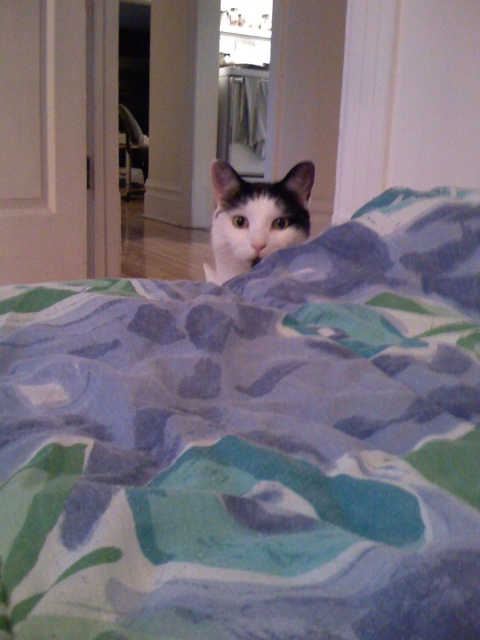
Question: Does printed fabric blanket at center have a larger size compared to white fur cat at center?

Choices:
 (A) no
 (B) yes

Answer: (B)

Question: Observing the image, what is the correct spatial positioning of printed fabric blanket at center in reference to white fur cat at center?

Choices:
 (A) above
 (B) below

Answer: (B)

Question: Which of the following is the closest to the observer?

Choices:
 (A) (310, 538)
 (B) (216, 272)

Answer: (A)

Question: Is printed fabric blanket at center positioned before white fur cat at center?

Choices:
 (A) yes
 (B) no

Answer: (A)